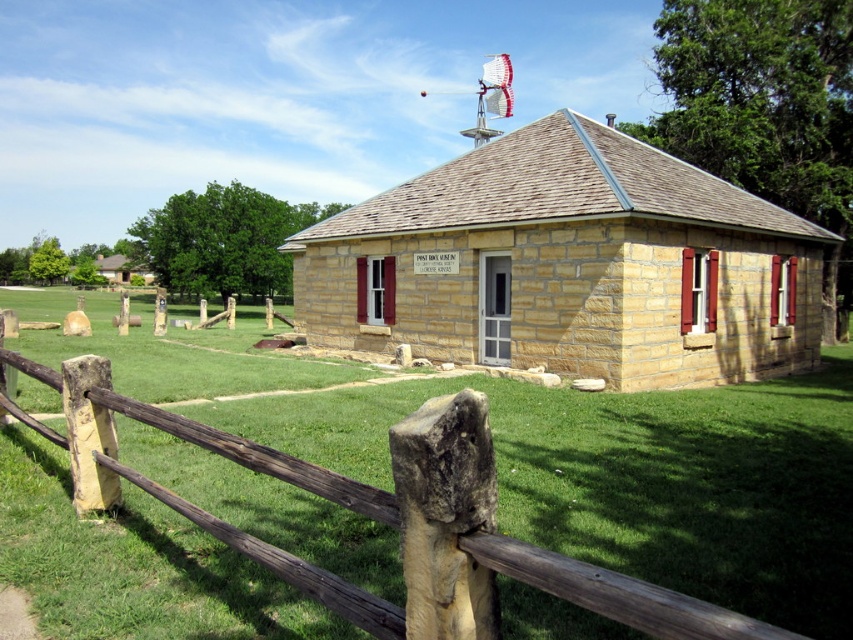
Question: Does brown stone building at center appear over brown wooden fence at lower left?

Choices:
 (A) no
 (B) yes

Answer: (B)

Question: Does brown stone building at center appear on the left side of brown wooden fence at lower left?

Choices:
 (A) yes
 (B) no

Answer: (A)

Question: Where is brown stone building at center located in relation to brown wooden fence at lower left in the image?

Choices:
 (A) above
 (B) below

Answer: (A)

Question: Which point is closer to the camera?

Choices:
 (A) coord(450,460)
 (B) coord(624,324)

Answer: (A)

Question: Which of the following is the farthest from the observer?

Choices:
 (A) brown wooden fence at lower left
 (B) brown stone building at center

Answer: (B)

Question: Among these points, which one is farthest from the camera?

Choices:
 (A) (338, 502)
 (B) (708, 372)

Answer: (B)